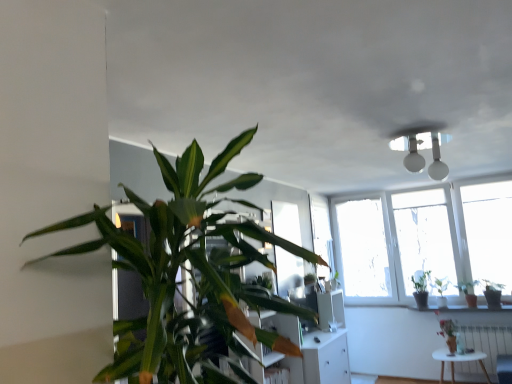
Question: From the image's perspective, is green glossy houseplant at lower right, the third houseplant in the left-to-right sequence, under green glossy plant at upper right, arranged as the 5th houseplant when viewed from the front?

Choices:
 (A) yes
 (B) no

Answer: (A)

Question: Is green glossy houseplant at lower right, placed as the fifth houseplant when sorted from back to front, aimed at green glossy plant at upper right, arranged as the 5th houseplant when viewed from the front?

Choices:
 (A) no
 (B) yes

Answer: (A)

Question: Can you confirm if green glossy houseplant at lower right, which appears as the 2th houseplant when viewed from the front, is bigger than green glossy plant at upper right, the second houseplant from the back?

Choices:
 (A) yes
 (B) no

Answer: (A)

Question: Is green glossy houseplant at lower right, which appears as the 2th houseplant when viewed from the front, positioned beyond the bounds of green glossy plant at upper right, the second houseplant from the back?

Choices:
 (A) no
 (B) yes

Answer: (B)

Question: Does green glossy houseplant at lower right, which appears as the 2th houseplant when viewed from the front, have a lesser width compared to green glossy plant at upper right, which ranks as the 3th houseplant in right-to-left order?

Choices:
 (A) no
 (B) yes

Answer: (A)

Question: From a real-world perspective, is green glossy houseplant at lower right, which is counted as the 4th houseplant, starting from the right, under green glossy plant at upper right, arranged as the 5th houseplant when viewed from the front?

Choices:
 (A) no
 (B) yes

Answer: (B)

Question: Is white metallic radiator at lower right taller than white matte table at lower right?

Choices:
 (A) no
 (B) yes

Answer: (B)

Question: Considering the relative sizes of white metallic radiator at lower right and white matte table at lower right in the image provided, is white metallic radiator at lower right smaller than white matte table at lower right?

Choices:
 (A) yes
 (B) no

Answer: (A)

Question: From the image's perspective, is white metallic radiator at lower right located beneath white matte table at lower right?

Choices:
 (A) yes
 (B) no

Answer: (B)

Question: From a real-world perspective, is white metallic radiator at lower right over white matte table at lower right?

Choices:
 (A) yes
 (B) no

Answer: (A)

Question: Is white metallic radiator at lower right thinner than white matte table at lower right?

Choices:
 (A) no
 (B) yes

Answer: (B)

Question: Can you confirm if white metallic radiator at lower right is shorter than white matte table at lower right?

Choices:
 (A) no
 (B) yes

Answer: (A)

Question: From the image's perspective, is green glossy plant at right, which ranks as the second houseplant in right-to-left order, below white metallic radiator at lower right?

Choices:
 (A) yes
 (B) no

Answer: (B)